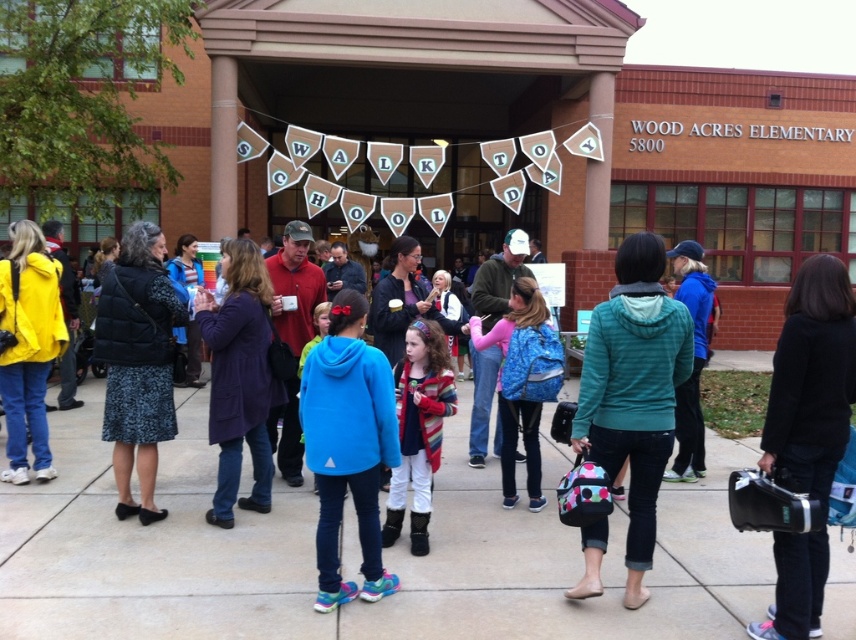
In the scene shown: Is blue fleece jacket at center closer to camera compared to striped sweater at center?

Yes, it is.

Is point (742, 442) farther from viewer compared to point (434, 360)?

Yes, point (742, 442) is farther from viewer.

Does point (271, 556) come behind point (417, 536)?

No, it is not.

The width and height of the screenshot is (856, 640). Find the location of `blue fleece jacket at center`. blue fleece jacket at center is located at coordinates click(382, 554).